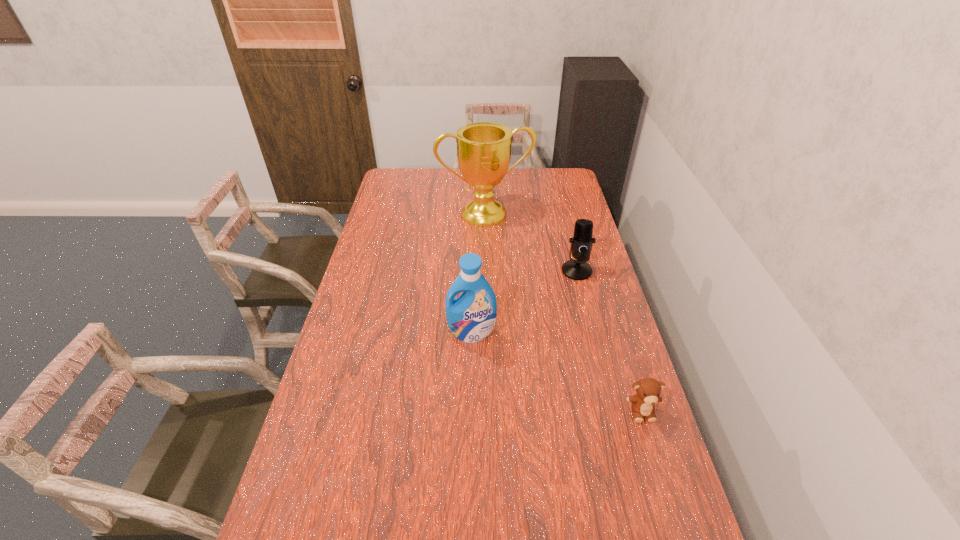
Find the location of a particular element. vacant position located on the shiny surface of the farthest object is located at coordinates (523, 282).

At what (x,y) coordinates should I click in order to perform the action: click on free space located on the shiny surface of the farthest object. Please return your answer as a coordinate pair (x, y). Looking at the image, I should click on click(511, 258).

At what (x,y) coordinates should I click in order to perform the action: click on vacant space located on the shiny surface of the farthest object. Please return your answer as a coordinate pair (x, y). Looking at the image, I should click on (525, 288).

At what (x,y) coordinates should I click in order to perform the action: click on vacant area located on the stand of the third tallest object. Please return your answer as a coordinate pair (x, y). Looking at the image, I should click on (565, 350).

Where is `vacant space positioned 0.070m on the stand of the third tallest object`? vacant space positioned 0.070m on the stand of the third tallest object is located at coordinates 573,293.

Image resolution: width=960 pixels, height=540 pixels. Find the location of `free space located 0.050m on the stand of the third tallest object`. free space located 0.050m on the stand of the third tallest object is located at coordinates (x=574, y=289).

Image resolution: width=960 pixels, height=540 pixels. I want to click on teddy bear situated at the right edge, so click(648, 390).

You are a GUI agent. You are given a task and a screenshot of the screen. Output one action in this format:
    pyautogui.click(x=<x>, y=<y>)
    Task: Click on the microphone positioned at the right edge
    Image resolution: width=960 pixels, height=540 pixels.
    Given the screenshot: What is the action you would take?
    pyautogui.click(x=581, y=243)

Where is `free space at the far edge of the desktop`? free space at the far edge of the desktop is located at coordinates (508, 179).

In the image, there is a desktop. What are the coordinates of `free space at the near edge` in the screenshot? It's located at [390, 527].